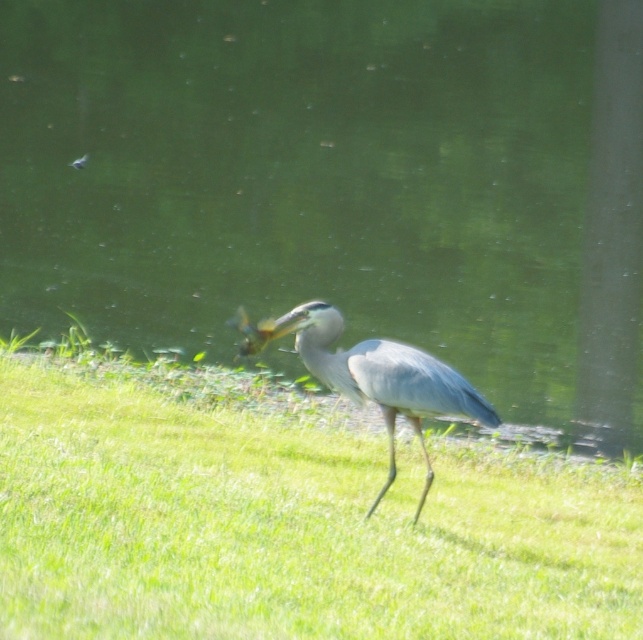
Which is in front, point (82, 264) or point (478, 412)?

Point (478, 412) is in front.

Does green water at center have a greater width compared to gray matte heron at center?

Correct, the width of green water at center exceeds that of gray matte heron at center.

Locate an element on the screen. The image size is (643, 640). green water at center is located at coordinates (340, 182).

Does green water at center appear on the right side of green grass at center?

No, green water at center is not to the right of green grass at center.

Between green water at center and green grass at center, which one has more height?

green water at center

Is point (35, 3) closer to viewer compared to point (239, 467)?

No, it is behind (239, 467).

This screenshot has height=640, width=643. What are the coordinates of `green water at center` in the screenshot? It's located at (340, 182).

Does green grass at center appear under gray matte heron at center?

Indeed, green grass at center is positioned under gray matte heron at center.

Does point (577, 483) come behind point (392, 364)?

Yes, point (577, 483) is farther from viewer.

The height and width of the screenshot is (640, 643). I want to click on green grass at center, so click(x=285, y=516).